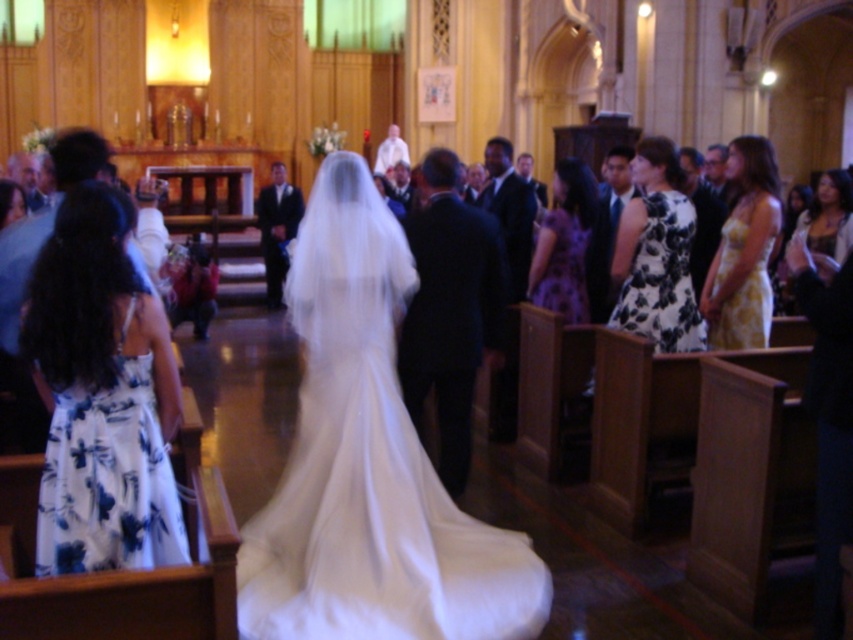
Can you confirm if white sheer veil at center is wider than purple satin dress at center?

Yes.

Is white sheer veil at center to the right of purple satin dress at center from the viewer's perspective?

In fact, white sheer veil at center is to the left of purple satin dress at center.

The height and width of the screenshot is (640, 853). What do you see at coordinates (369, 464) in the screenshot? I see `white sheer veil at center` at bounding box center [369, 464].

At what (x,y) coordinates should I click in order to perform the action: click on white sheer veil at center. Please return your answer as a coordinate pair (x, y). The width and height of the screenshot is (853, 640). Looking at the image, I should click on (369, 464).

Is white floral dress at left closer to camera compared to matte gold necklace at upper right?

Yes.

Which is behind, point (123, 557) or point (816, 202)?

Point (816, 202)

Identify the location of white floral dress at left. Image resolution: width=853 pixels, height=640 pixels. (102, 396).

Is black floral dress at center wider than purple satin dress at center?

Correct, the width of black floral dress at center exceeds that of purple satin dress at center.

This screenshot has height=640, width=853. Describe the element at coordinates (656, 253) in the screenshot. I see `black floral dress at center` at that location.

This screenshot has height=640, width=853. What are the coordinates of `black floral dress at center` in the screenshot? It's located at (656, 253).